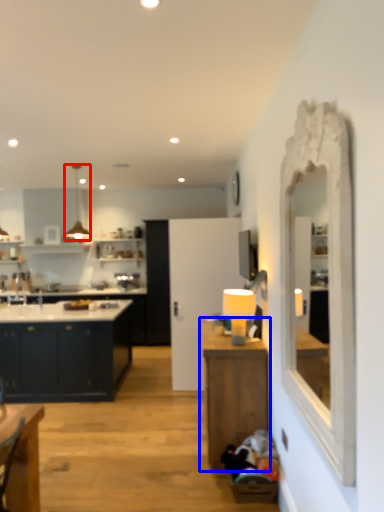
Question: Which object appears farthest to the camera in this image, light fixture (highlighted by a red box) or table (highlighted by a blue box)?

Choices:
 (A) light fixture
 (B) table

Answer: (A)